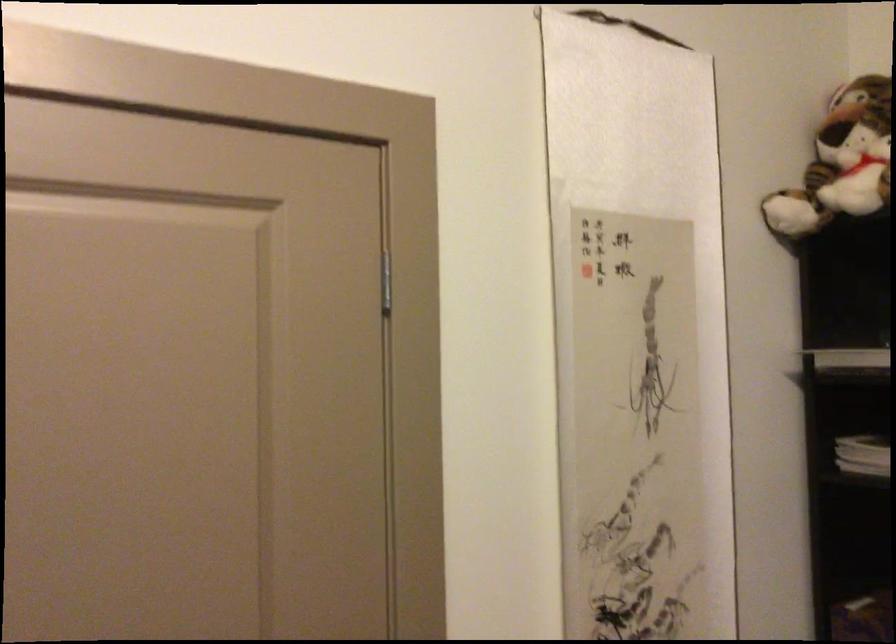
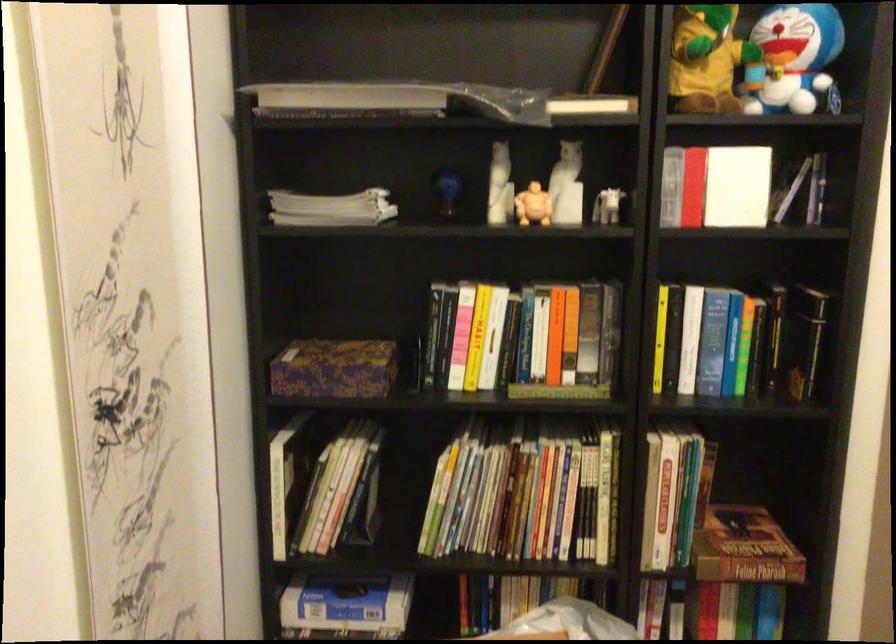
Question: The images are taken continuously from a first-person perspective. In which direction is your viewpoint rotating?

Choices:
 (A) Left
 (B) Right
 (C) Up
 (D) Down

Answer: (B)